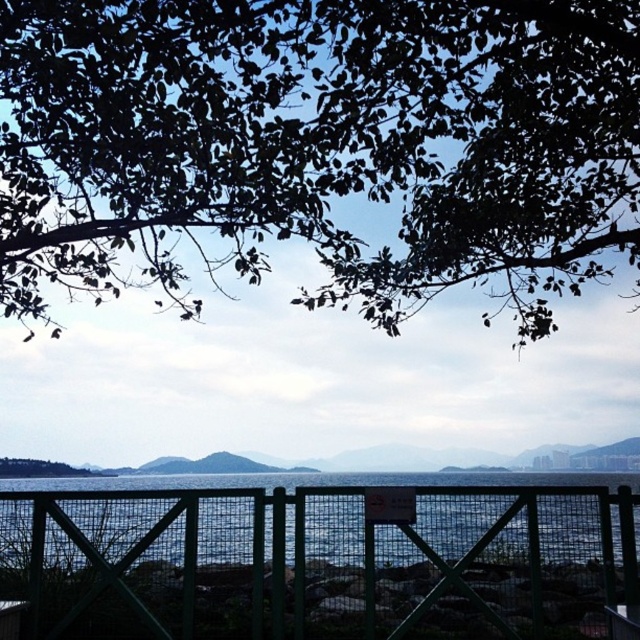
You are standing at the camera position and want to take a photo of the green leafy tree at upper center. If your camera has a maximum focus range of 3 meters, will you be able to focus on the tree?

The green leafy tree at upper center is 3.84 meters away from the camera. Since the maximum focus range is 3 meters, the camera cannot focus on the tree because it is beyond the 3 meter limit.

You are standing on the beach looking at the scene. Which object is higher up in the image, the green leafy tree at upper center or the green metal fence at lower center?

The green leafy tree at upper center is located above the green metal fence at lower center in the image.